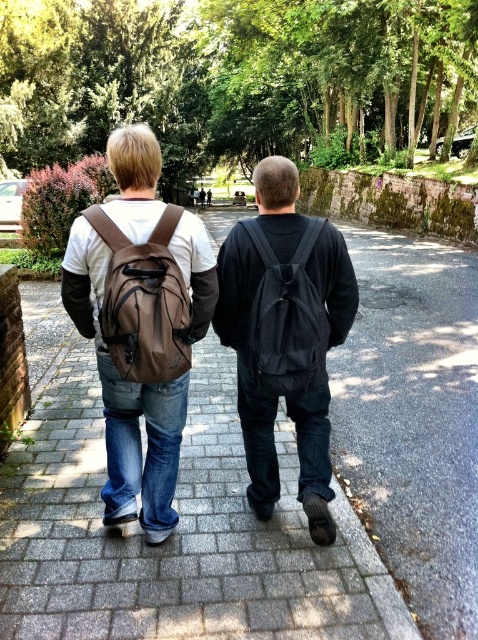
You are a delivery drone that needs to fly between the two backpacks. The minimum distance required for safe flight is 10 feet. Can you safely fly between the brown leather backpack at center and the black matte backpack at center?

The distance between the brown leather backpack at center and the black matte backpack at center is 8.14 feet, which is less than the required 10 feet for safe flight. Therefore, the drone cannot safely fly between them.

You are a photographer trying to capture a clear shot of the black matte backpack at center and the dark blue jeans at center. Since the backpack is smaller, will it be easier to focus on the backpack compared to the jeans?

The black matte backpack at center occupies less space than dark blue jeans at center, so focusing on the backpack might be easier due to its smaller size, but both should be in focus if they are at the same distance from the camera.